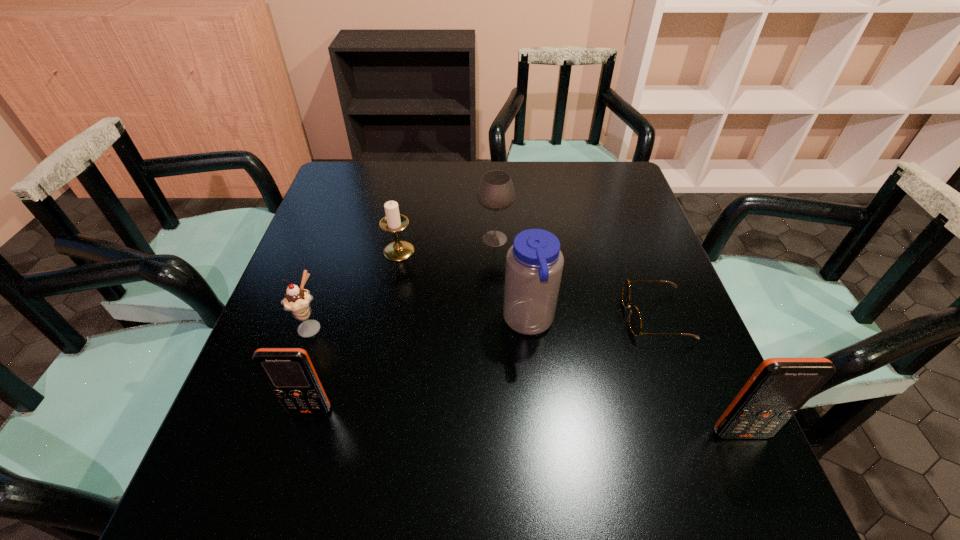
If the aim is uniform spacing by inserting an additional cellular_telephone among them, please point to a vacant space for this new cellular_telephone. Please provide its 2D coordinates. Your answer should be formatted as a tuple, i.e. [(x, y)], where the tuple contains the x and y coordinates of a point satisfying the conditions above.

[(521, 422)]